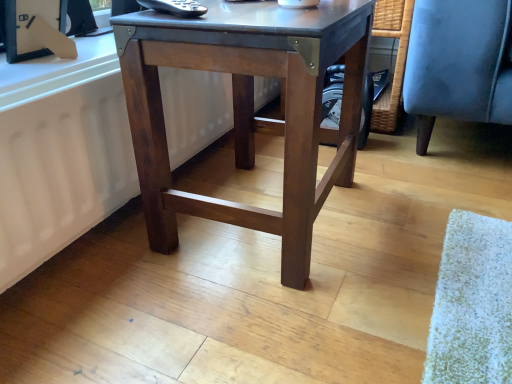
Question: From the image's perspective, is dark brown wood table at center positioned above or below white matte radiator at lower left?

Choices:
 (A) below
 (B) above

Answer: (B)

Question: From a real-world perspective, is dark brown wood table at center above or below white matte radiator at lower left?

Choices:
 (A) above
 (B) below

Answer: (A)

Question: Considering the positions of dark brown wood table at center and white matte radiator at lower left in the image, is dark brown wood table at center bigger or smaller than white matte radiator at lower left?

Choices:
 (A) small
 (B) big

Answer: (B)

Question: From a real-world perspective, is white matte radiator at lower left positioned above or below dark brown wood table at center?

Choices:
 (A) below
 (B) above

Answer: (A)

Question: Visually, is white matte radiator at lower left positioned to the left or to the right of dark brown wood table at center?

Choices:
 (A) right
 (B) left

Answer: (B)

Question: Considering the positions of point (10, 273) and point (239, 107), is point (10, 273) closer or farther from the camera than point (239, 107)?

Choices:
 (A) farther
 (B) closer

Answer: (B)

Question: In the image, is white matte radiator at lower left positioned in front of or behind dark brown wood table at center?

Choices:
 (A) behind
 (B) front

Answer: (A)